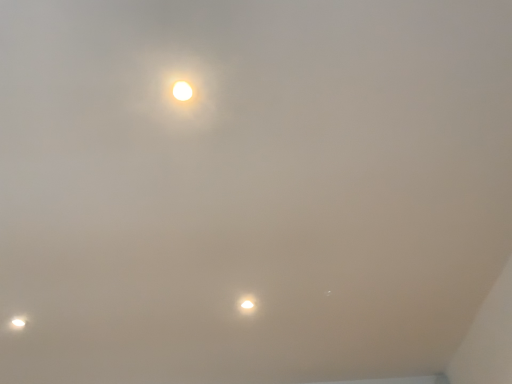
Question: Is matte white lamp at lower left, which is the 1th lamp in bottom-to-top order, in front of matte white lamp at center, the 2th lamp in the back-to-front sequence?

Choices:
 (A) yes
 (B) no

Answer: (B)

Question: Considering the relative sizes of matte white lamp at lower left, which ranks as the second lamp in front-to-back order, and matte white lamp at center, acting as the second lamp starting from the bottom, in the image provided, is matte white lamp at lower left, which ranks as the second lamp in front-to-back order, bigger than matte white lamp at center, acting as the second lamp starting from the bottom,?

Choices:
 (A) yes
 (B) no

Answer: (B)

Question: Is matte white lamp at center, arranged as the second lamp when viewed from the left, inside matte white lamp at lower left, the 2th lamp when ordered from right to left?

Choices:
 (A) no
 (B) yes

Answer: (A)

Question: Is matte white lamp at lower left, the 2th lamp when ordered from right to left, positioned behind matte white lamp at center, arranged as the 1th lamp when viewed from the top?

Choices:
 (A) yes
 (B) no

Answer: (A)

Question: Considering the relative sizes of matte white lamp at lower left, arranged as the second lamp when viewed from the top, and matte white lamp at center, acting as the second lamp starting from the bottom, in the image provided, is matte white lamp at lower left, arranged as the second lamp when viewed from the top, thinner than matte white lamp at center, acting as the second lamp starting from the bottom,?

Choices:
 (A) no
 (B) yes

Answer: (A)

Question: Is matte white lamp at lower left, arranged as the second lamp when viewed from the top, outside matte white lamp at center, which appears as the first lamp when viewed from the right?

Choices:
 (A) no
 (B) yes

Answer: (B)

Question: Is matte white lamp at center, the 2th lamp in the back-to-front sequence, completely or partially outside of matte white lamp at lower left, the 2th lamp when ordered from right to left?

Choices:
 (A) no
 (B) yes

Answer: (B)

Question: Does matte white lamp at center, which appears as the first lamp when viewed from the right, have a lesser width compared to matte white lamp at lower left, arranged as the second lamp when viewed from the top?

Choices:
 (A) yes
 (B) no

Answer: (A)

Question: Is matte white lamp at center, which appears as the first lamp when viewed from the right, smaller than matte white lamp at lower left, which ranks as the second lamp in front-to-back order?

Choices:
 (A) yes
 (B) no

Answer: (B)

Question: Is matte white lamp at center, arranged as the second lamp when viewed from the left, far away from matte white lamp at lower left, the 2th lamp when ordered from right to left?

Choices:
 (A) no
 (B) yes

Answer: (A)

Question: Considering the relative sizes of matte white lamp at center, the 2th lamp in the back-to-front sequence, and matte white lamp at lower left, which is the 1th lamp in bottom-to-top order, in the image provided, is matte white lamp at center, the 2th lamp in the back-to-front sequence, taller than matte white lamp at lower left, which is the 1th lamp in bottom-to-top order,?

Choices:
 (A) yes
 (B) no

Answer: (A)

Question: Can you confirm if matte white lamp at center, acting as the second lamp starting from the bottom, is shorter than matte white lamp at lower left, the 2th lamp when ordered from right to left?

Choices:
 (A) yes
 (B) no

Answer: (B)

Question: Is matte white lamp at lower left, which ranks as the second lamp in front-to-back order, spatially inside matte white lamp at center, the 2th lamp in the back-to-front sequence, or outside of it?

Choices:
 (A) inside
 (B) outside

Answer: (B)